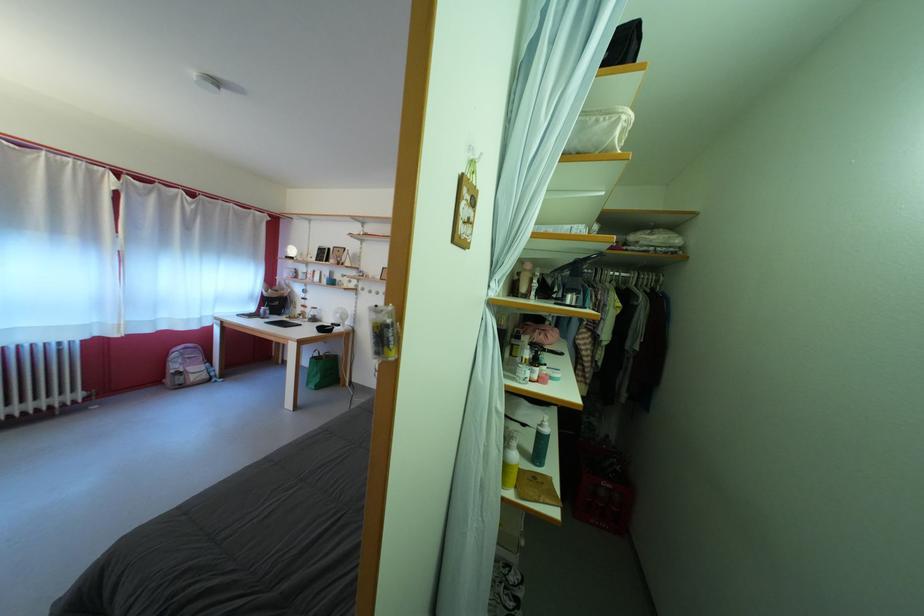
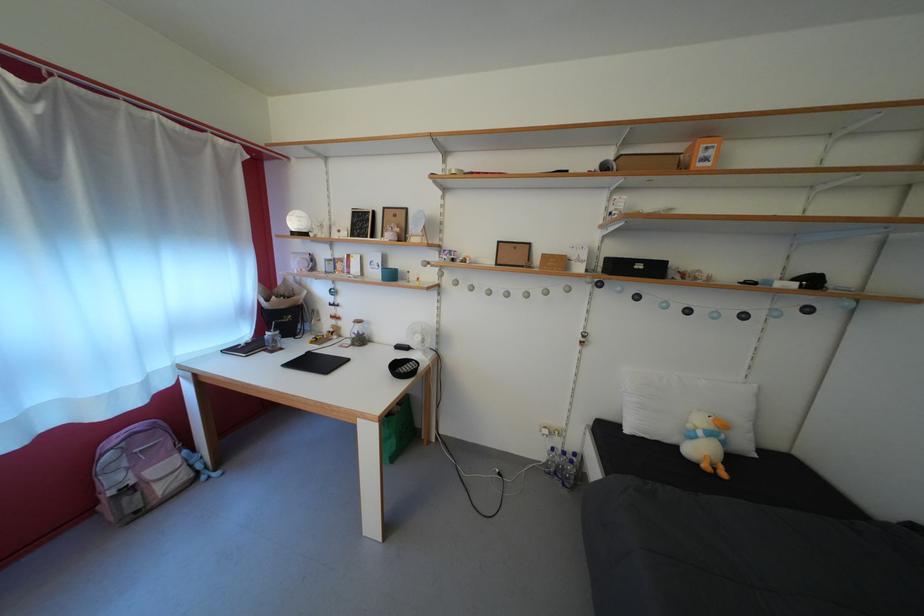
Locate, in the second image, the point that corresponds to point 346,322 in the first image.

(427, 344)